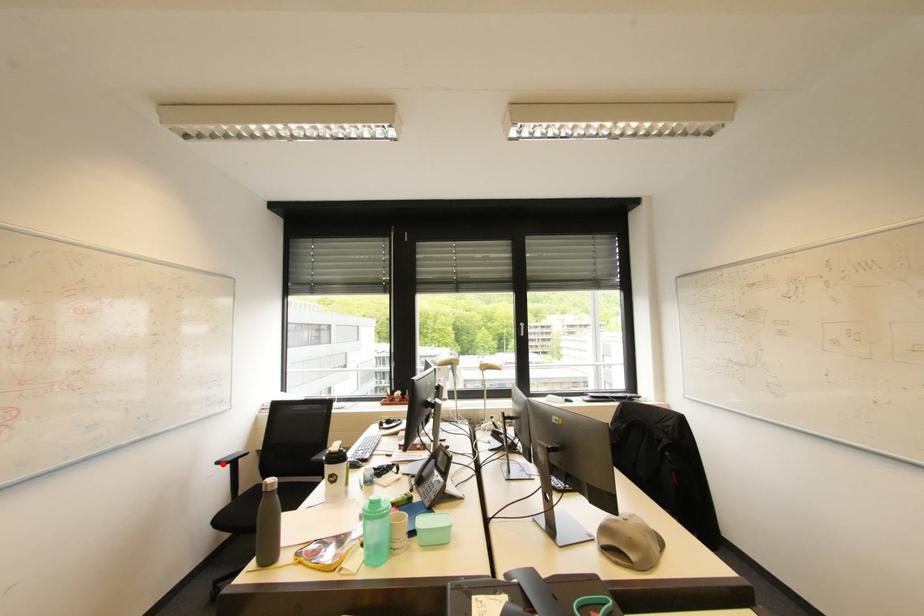
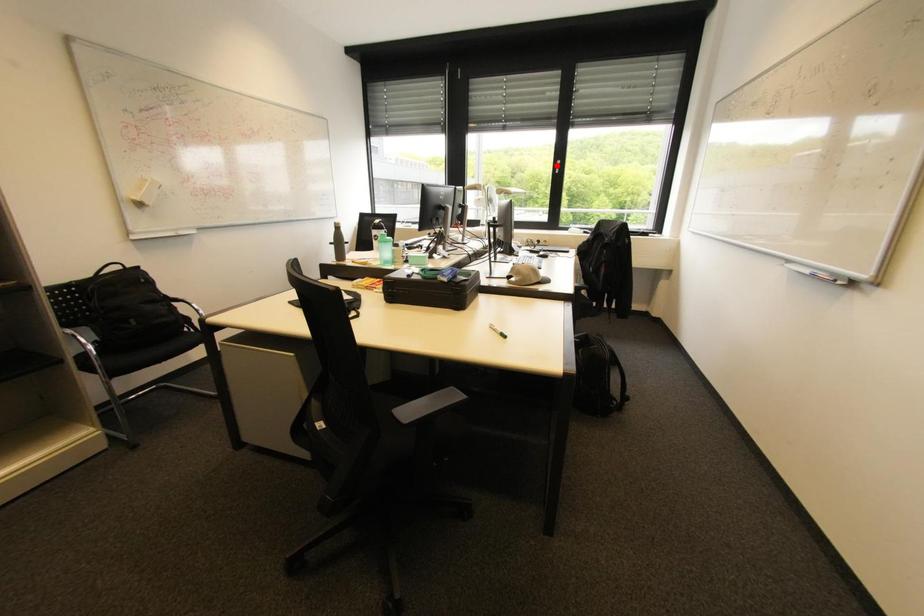
I am providing you with two images of the same scene from different viewpoints. A red point is marked on the first image and another point is marked on the second image. Does the point marked in image1 correspond to the same location as the one in image2?

No